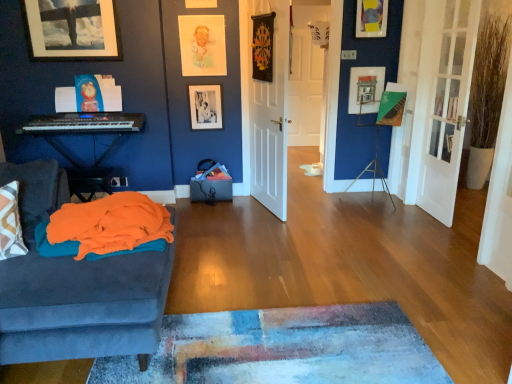
Where is `free space in front of white matte door at center, arranged as the 3th door when viewed from the right`? Image resolution: width=512 pixels, height=384 pixels. free space in front of white matte door at center, arranged as the 3th door when viewed from the right is located at coordinates (258, 227).